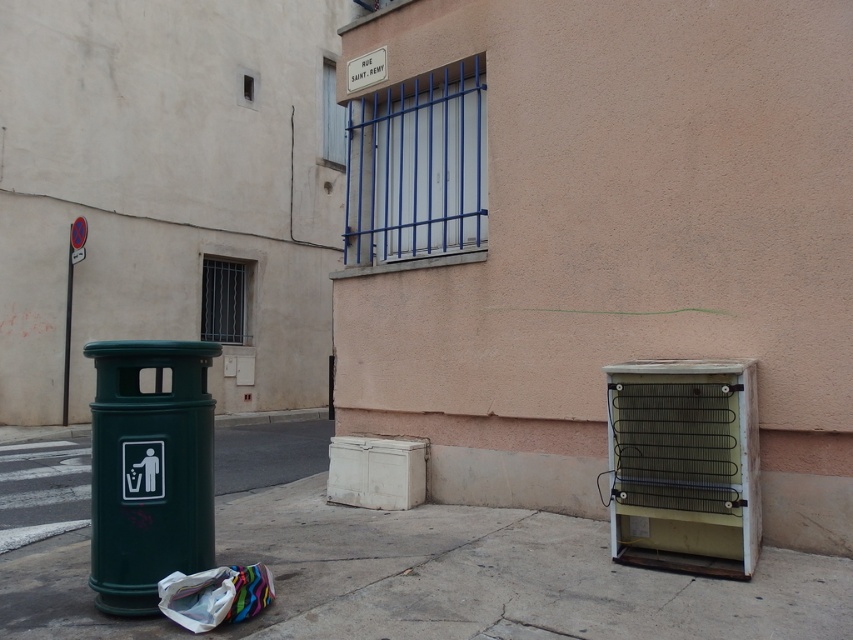
Is concrete at lower center thinner than green plastic trash can at left?

Incorrect, concrete at lower center's width is not less than green plastic trash can at left's.

What do you see at coordinates (497, 577) in the screenshot? I see `concrete at lower center` at bounding box center [497, 577].

What are the coordinates of `concrete at lower center` in the screenshot? It's located at (497, 577).